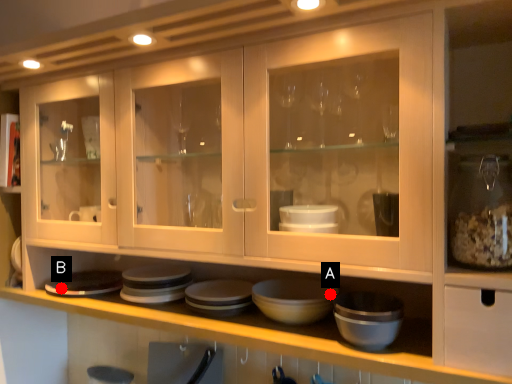
Question: Two points are circled on the image, labeled by A and B beside each circle. Which of the following is the farthest from the observer?

Choices:
 (A) A is further
 (B) B is further

Answer: (B)